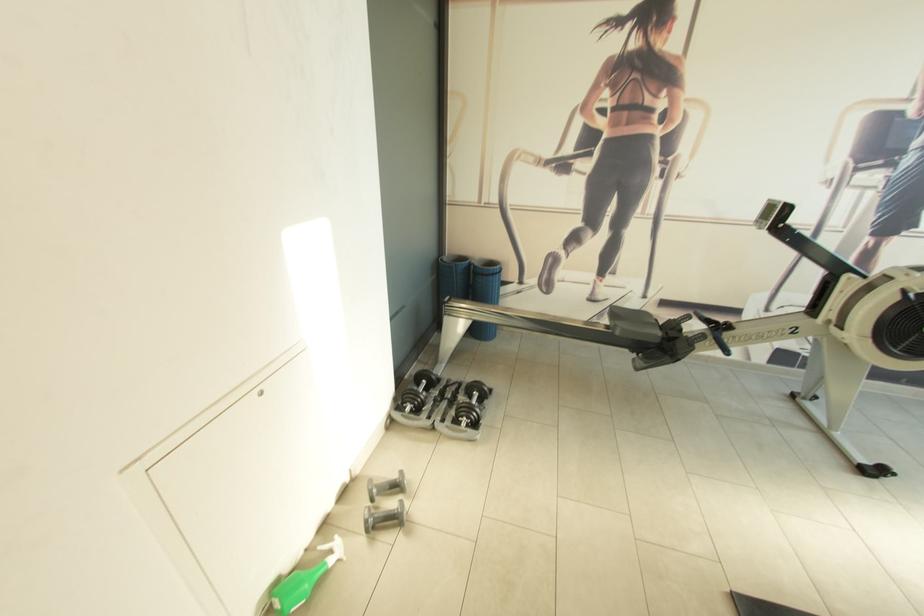
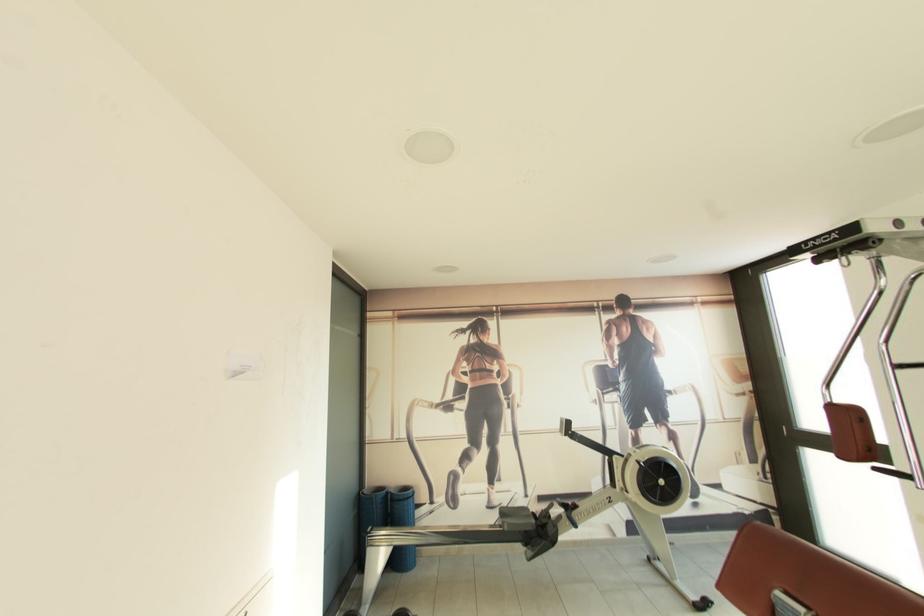
Locate, in the second image, the point that corresponds to point (497, 265) in the first image.

(410, 490)